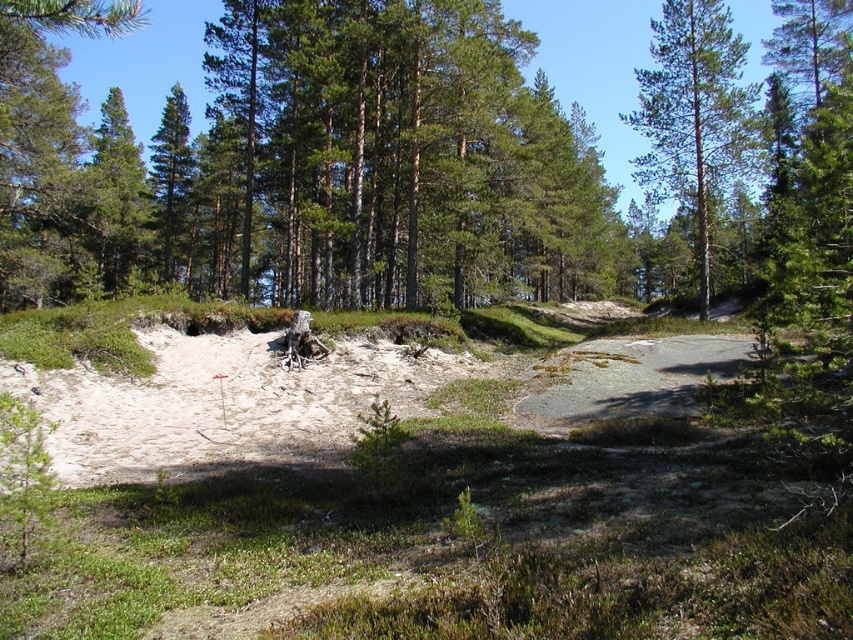
Question: Does green textured pine tree at upper center have a greater width compared to green matte tree at center?

Choices:
 (A) no
 (B) yes

Answer: (B)

Question: Where is green textured pine tree at upper center located in relation to green matte tree at center in the image?

Choices:
 (A) right
 (B) left

Answer: (A)

Question: Is sandy/grainy sand at center bigger than green textured pine tree at upper center?

Choices:
 (A) yes
 (B) no

Answer: (B)

Question: Which object is farther from the camera taking this photo?

Choices:
 (A) green matte tree at center
 (B) green textured pine tree at upper center

Answer: (A)

Question: Based on their relative distances, which object is nearer to the green matte tree at center?

Choices:
 (A) sandy/grainy sand at center
 (B) green textured pine tree at upper center

Answer: (A)

Question: Which point appears closest to the camera in this image?

Choices:
 (A) (161, 216)
 (B) (361, 371)
 (C) (718, 145)

Answer: (B)